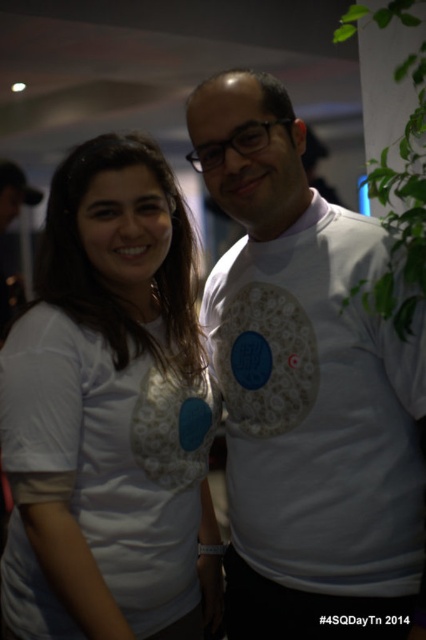
Is white lace shirt at left positioned before green leafy plant at upper right?

No, it is behind green leafy plant at upper right.

Is white lace shirt at left above green leafy plant at upper right?

Actually, white lace shirt at left is below green leafy plant at upper right.

At what (x,y) coordinates should I click in order to perform the action: click on white lace shirt at left. Please return your answer as a coordinate pair (x, y). Looking at the image, I should click on (109, 413).

Can you confirm if white matte t-shirt at center is positioned to the right of green leafy plant at upper right?

In fact, white matte t-shirt at center is to the left of green leafy plant at upper right.

At what (x,y) coordinates should I click in order to perform the action: click on white matte t-shirt at center. Please return your answer as a coordinate pair (x, y). This screenshot has height=640, width=426. Looking at the image, I should click on (305, 388).

Where is `white matte t-shirt at center`? Image resolution: width=426 pixels, height=640 pixels. white matte t-shirt at center is located at coordinates (305, 388).

Between point (267, 90) and point (193, 436), which one is positioned in front?

Positioned in front is point (267, 90).

The image size is (426, 640). I want to click on white matte t-shirt at center, so click(x=305, y=388).